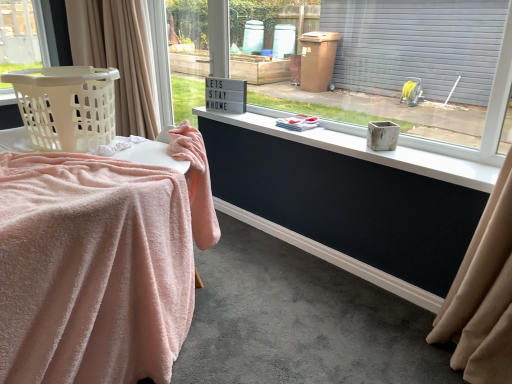
What do you see at coordinates (198, 37) in the screenshot? This screenshot has width=512, height=384. I see `white plastic sign at upper center` at bounding box center [198, 37].

The height and width of the screenshot is (384, 512). What do you see at coordinates (486, 114) in the screenshot?
I see `matte concrete planter at center` at bounding box center [486, 114].

What do you see at coordinates (66, 106) in the screenshot? Image resolution: width=512 pixels, height=384 pixels. I see `beige plastic laundry basket at left` at bounding box center [66, 106].

Locate an element on the screen. The width and height of the screenshot is (512, 384). pink fluffy blanket at left is located at coordinates (153, 153).

The height and width of the screenshot is (384, 512). Identify the location of white matte concrete at center. (369, 149).

From the image's perspective, is white plastic sign at upper center located above or below pink fluffy blanket at left?

white plastic sign at upper center is above pink fluffy blanket at left.

Considering the points (213, 62) and (17, 140), which point is in front, point (213, 62) or point (17, 140)?

The point (17, 140) is in front.

Locate an element on the screen. The height and width of the screenshot is (384, 512). window frame above the pink fluffy blanket at left (from the image's perspective) is located at coordinates (198, 37).

Can you confirm if white plastic sign at upper center is wider than pink fluffy blanket at left?

No, white plastic sign at upper center is not wider than pink fluffy blanket at left.

Is beige fabric curtain at left positioned with its back to beige plastic laundry basket at left?

That's not correct — beige fabric curtain at left is not looking away from beige plastic laundry basket at left.

Choose the correct answer: Is beige fabric curtain at left inside beige plastic laundry basket at left or outside it?

The correct answer is: outside.

What's the angular difference between beige fabric curtain at left and beige plastic laundry basket at left's facing directions?

The angle between the facing direction of beige fabric curtain at left and the facing direction of beige plastic laundry basket at left is 88.1 degrees.

Is there a large distance between white matte concrete at center and matte concrete planter at center?

That's not correct — white matte concrete at center is a little close to matte concrete planter at center.

This screenshot has width=512, height=384. I want to click on window sill that appears below the matte concrete planter at center (from a real-world perspective), so click(369, 149).

Measure the distance from white matte concrete at center to matte concrete planter at center.

white matte concrete at center and matte concrete planter at center are 17.52 inches apart from each other.

Does point (357, 130) come farther from viewer compared to point (496, 92)?

Yes.

In the image, is matte concrete planter at center positioned in front of or behind beige fabric curtain at left?

In the image, matte concrete planter at center appears in front of beige fabric curtain at left.

Is matte concrete planter at center situated inside beige fabric curtain at left or outside?

matte concrete planter at center is located beyond the bounds of beige fabric curtain at left.

From the image's perspective, between matte concrete planter at center and beige fabric curtain at left, who is located below?

From the image's view, matte concrete planter at center is below.

Can you tell me how much beige plastic laundry basket at left and pink fluffy blanket at left differ in facing direction?

They differ by 0.000137 degrees in their facing directions.

Consider the image. Considering the relative positions of beige plastic laundry basket at left and pink fluffy blanket at left in the image provided, is beige plastic laundry basket at left to the left or to the right of pink fluffy blanket at left?

In the image, beige plastic laundry basket at left appears on the left side of pink fluffy blanket at left.

Is beige plastic laundry basket at left positioned behind pink fluffy blanket at left?

Yes, beige plastic laundry basket at left is further from the viewer.

You are a GUI agent. You are given a task and a screenshot of the screen. Output one action in this format:
    pyautogui.click(x=<x>, y=<y>)
    Task: Click on the window frame behind the white matte concrete at center
    
    Given the screenshot: What is the action you would take?
    pyautogui.click(x=198, y=37)

Considering the relative sizes of white matte concrete at center and white plastic sign at upper center in the image provided, is white matte concrete at center thinner than white plastic sign at upper center?

In fact, white matte concrete at center might be wider than white plastic sign at upper center.

From a real-world perspective, which is physically below, white matte concrete at center or white plastic sign at upper center?

From a 3D spatial view, white matte concrete at center is below.

Does white matte concrete at center have a greater height compared to white plastic sign at upper center?

No.

Is beige fabric curtain at left smaller than white matte concrete at center?

No, beige fabric curtain at left is not smaller than white matte concrete at center.

Is white matte concrete at center completely or partially inside beige fabric curtain at left?

No, beige fabric curtain at left does not contain white matte concrete at center.

Does beige fabric curtain at left turn towards white matte concrete at center?

No, beige fabric curtain at left is not aimed at white matte concrete at center.

Which object is positioned more to the right, beige fabric curtain at left or white matte concrete at center?

Positioned to the right is white matte concrete at center.

This screenshot has width=512, height=384. In order to click on table in front of the white plastic sign at upper center in this screenshot , I will do `click(153, 153)`.

At what (x,y) coordinates should I click in order to perform the action: click on curtain beneath the beige plastic laundry basket at left (from a real-world perspective). Please return your answer as a coordinate pair (x, y). The image size is (512, 384). Looking at the image, I should click on (118, 57).

Considering their positions, is beige fabric curtain at left positioned closer to beige plastic laundry basket at left than white plastic sign at upper center?

beige fabric curtain at left.

When comparing their distances from beige plastic laundry basket at left, does beige fabric curtain at left or matte concrete planter at center seem closer?

beige fabric curtain at left.

Based on their spatial positions, is white plastic sign at upper center or matte concrete planter at center closer to beige fabric curtain at left?

Among the two, white plastic sign at upper center is located nearer to beige fabric curtain at left.

Looking at the image, which one is located closer to white plastic sign at upper center, white matte concrete at center or beige fabric curtain at left?

Based on the image, beige fabric curtain at left appears to be nearer to white plastic sign at upper center.

Which object lies further to the anchor point white plastic sign at upper center, matte concrete planter at center or beige plastic laundry basket at left?

Based on the image, matte concrete planter at center appears to be further to white plastic sign at upper center.

Considering their positions, is white matte concrete at center positioned closer to beige fabric curtain at left than matte concrete planter at center?

Based on the image, white matte concrete at center appears to be nearer to beige fabric curtain at left.

From the image, which object appears to be farther from matte concrete planter at center, white plastic sign at upper center or beige fabric curtain at left?

Among the two, white plastic sign at upper center is located further to matte concrete planter at center.

Looking at the image, which one is located closer to white plastic sign at upper center, beige fabric curtain at left or pink fluffy blanket at left?

beige fabric curtain at left is closer to white plastic sign at upper center.

The width and height of the screenshot is (512, 384). What are the coordinates of `window located between pink fluffy blanket at left and beige fabric curtain at left in the depth direction` in the screenshot? It's located at (486, 114).

This screenshot has width=512, height=384. Identify the location of window sill between beige fabric curtain at left and matte concrete planter at center in the horizontal direction. 369,149.

Locate an element on the screen. This screenshot has width=512, height=384. table situated between beige plastic laundry basket at left and white matte concrete at center from left to right is located at coordinates (153, 153).

Locate an element on the screen. The image size is (512, 384). window sill located between pink fluffy blanket at left and matte concrete planter at center in the left-right direction is located at coordinates (369, 149).